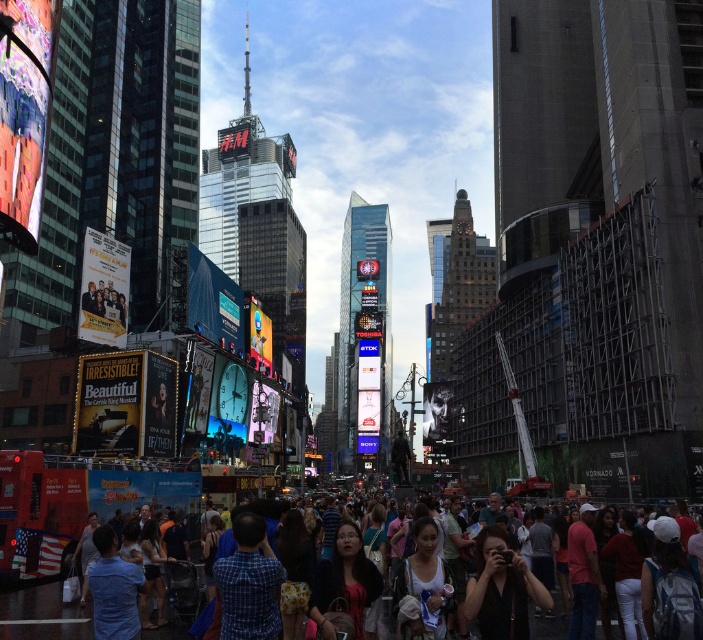
Between point (269, 598) and point (385, 620), which one is positioned in front?

Point (269, 598)

Which of these two, blue plaid shirt at center or multicolored casual attire at center, stands taller?

Standing taller between the two is multicolored casual attire at center.

You are a GUI agent. You are given a task and a screenshot of the screen. Output one action in this format:
    pyautogui.click(x=<x>, y=<y>)
    Task: Click on the blue plaid shirt at center
    The width and height of the screenshot is (703, 640).
    Given the screenshot: What is the action you would take?
    pyautogui.click(x=247, y=582)

Find the location of a particular element. This screenshot has width=703, height=640. blue plaid shirt at center is located at coordinates (247, 582).